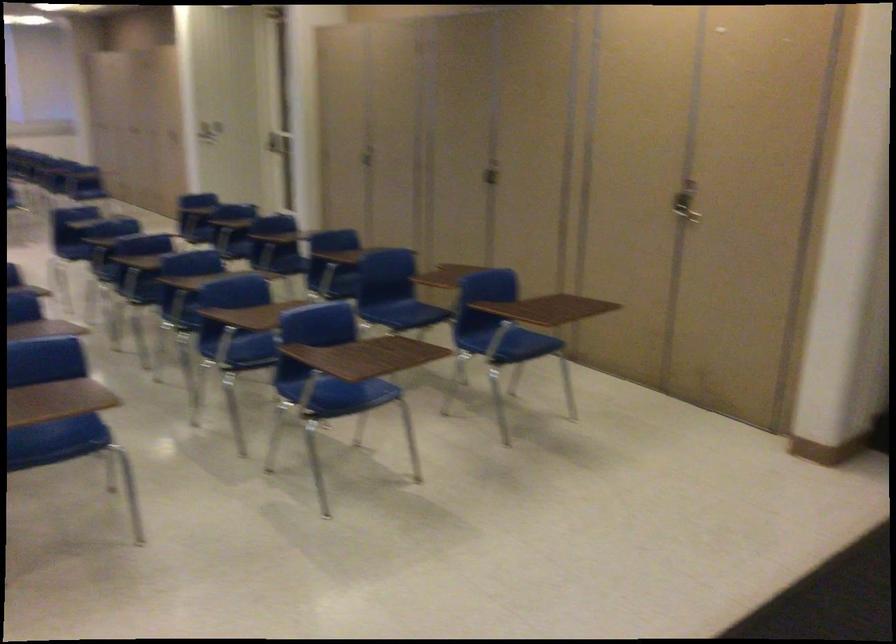
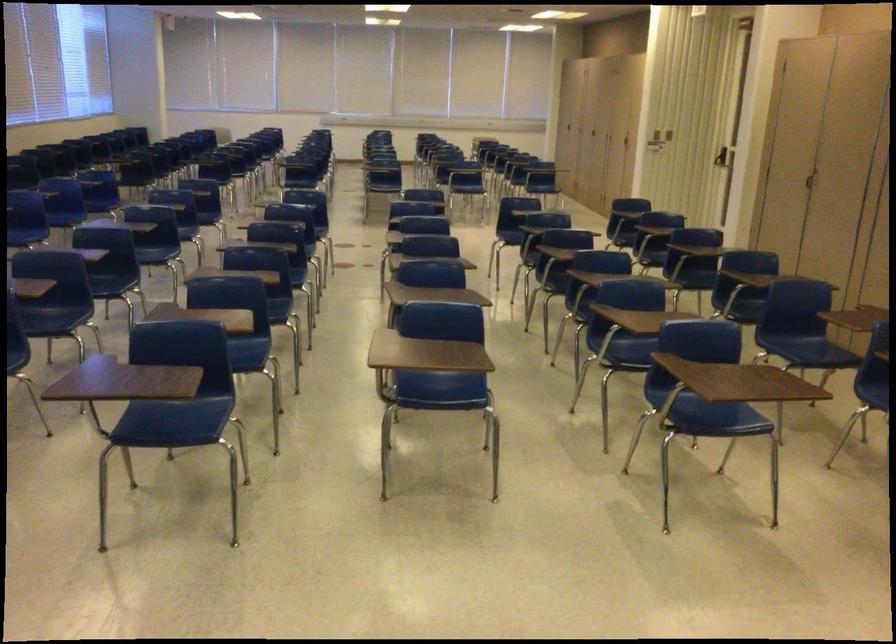
In the second image, find the point that corresponds to pixel 401 144 in the first image.

(853, 173)